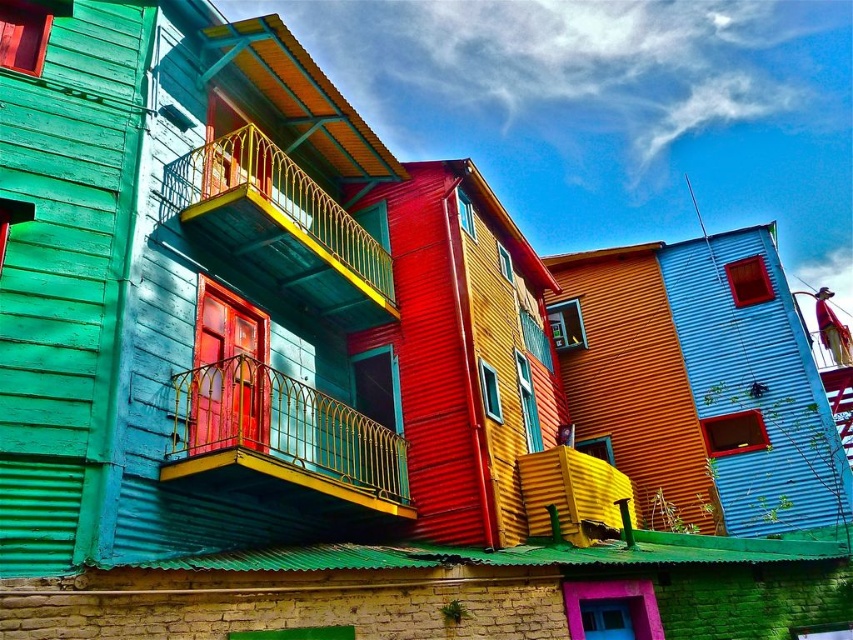
Measure the distance from gold wrought iron balcony at center to yellow metal railing at upper left.

The distance of gold wrought iron balcony at center from yellow metal railing at upper left is 6.34 feet.

This screenshot has width=853, height=640. What do you see at coordinates (282, 440) in the screenshot?
I see `gold wrought iron balcony at center` at bounding box center [282, 440].

In order to click on gold wrought iron balcony at center in this screenshot , I will do `click(282, 440)`.